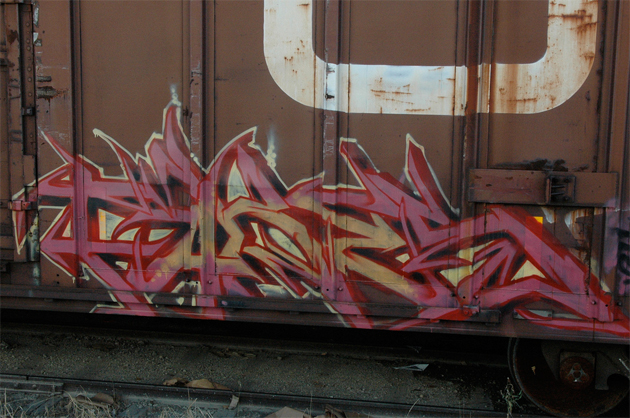
This screenshot has height=418, width=630. In order to click on lock in this screenshot , I will do `click(556, 187)`.